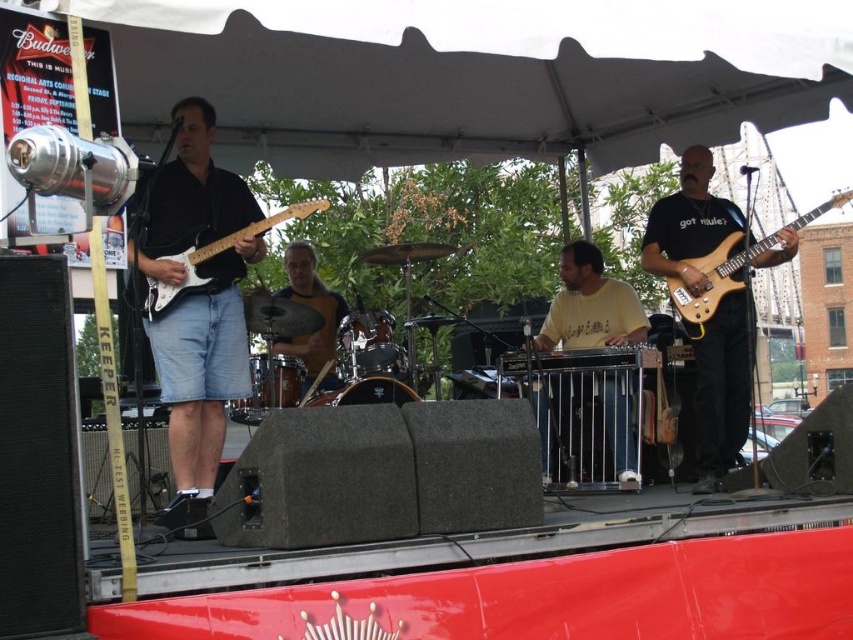
Question: Can you confirm if matte black guitar at right is positioned above yellow matte maracas at center?

Choices:
 (A) no
 (B) yes

Answer: (B)

Question: Which of the following is the closest to the observer?

Choices:
 (A) (169, 289)
 (B) (314, 360)

Answer: (A)

Question: Which point is closer to the camera?

Choices:
 (A) matte black guitar at left
 (B) yellow fabric shirt at center

Answer: (A)

Question: Estimate the real-world distances between objects in this image. Which object is farther from the yellow fabric shirt at center?

Choices:
 (A) yellow matte maracas at center
 (B) white glossy electric guitar at left
 (C) matte black guitar at left
 (D) matte black guitar at right

Answer: (D)

Question: Where is matte black guitar at left located in relation to white glossy electric guitar at left in the image?

Choices:
 (A) right
 (B) left

Answer: (A)

Question: Does matte black guitar at left have a greater width compared to yellow matte maracas at center?

Choices:
 (A) no
 (B) yes

Answer: (B)